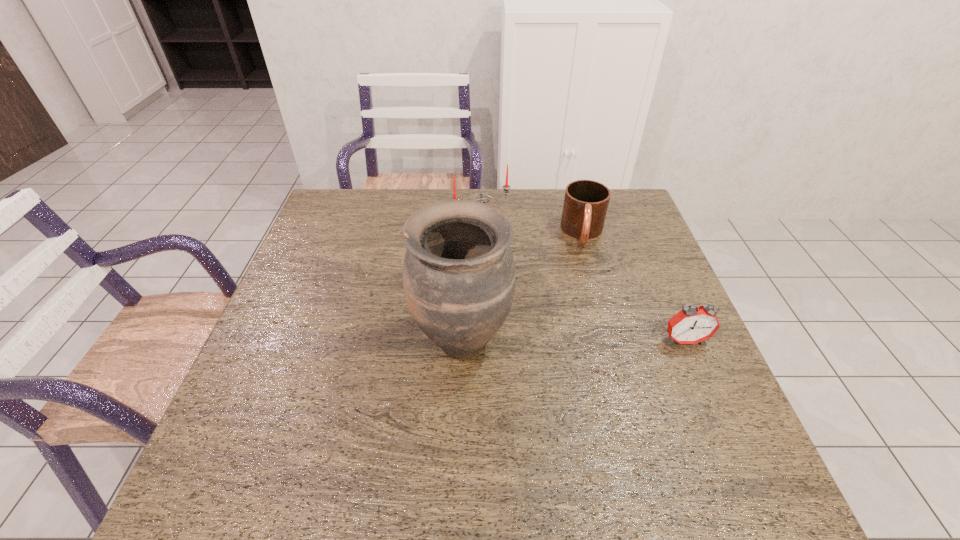
The height and width of the screenshot is (540, 960). In order to click on vacant position located on the side of the third object from left to right with the handle in this screenshot , I will do `click(588, 362)`.

Where is `blank space located on the side of the third object from left to right with the handle`? blank space located on the side of the third object from left to right with the handle is located at coordinates (586, 287).

This screenshot has height=540, width=960. I want to click on candle at the far edge, so click(x=506, y=187).

Image resolution: width=960 pixels, height=540 pixels. What are the coordinates of `mug at the far edge` in the screenshot? It's located at (585, 206).

I want to click on alarm clock at the right edge, so click(x=691, y=325).

Where is `mug present at the right edge`? The width and height of the screenshot is (960, 540). mug present at the right edge is located at coordinates (585, 206).

Find the location of a particular element. object present at the far right corner is located at coordinates (585, 206).

I want to click on free region at the far edge of the desktop, so click(534, 190).

Where is `free space at the near edge`? free space at the near edge is located at coordinates (374, 441).

This screenshot has width=960, height=540. In order to click on free space at the left edge in this screenshot , I will do `click(311, 343)`.